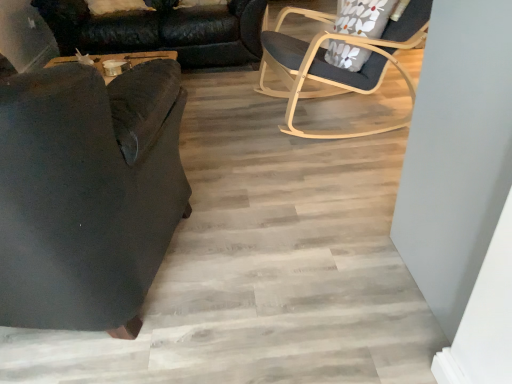
Where is `dark fabric chair at left, positioned as the first chair in left-to-right order`? dark fabric chair at left, positioned as the first chair in left-to-right order is located at coordinates (87, 193).

How different are the orientations of black leather couch at left and light wood/transparentobject at upper right, the second chair viewed from the left, in degrees?

82.6 degrees separate the facing orientations of black leather couch at left and light wood/transparentobject at upper right, the second chair viewed from the left.

Are black leather couch at left and light wood/transparentobject at upper right, the second chair viewed from the left, located far from each other?

black leather couch at left is positioned a significant distance from light wood/transparentobject at upper right, the second chair viewed from the left.

From a real-world perspective, is black leather couch at left positioned under light wood/transparentobject at upper right, arranged as the first chair when viewed from the right, based on gravity?

Yes, from a real-world perspective, black leather couch at left is below light wood/transparentobject at upper right, arranged as the first chair when viewed from the right.

Is black leather couch at left inside the boundaries of light wood/transparentobject at upper right, which is the 2th chair in front-to-back order, or outside?

black leather couch at left is outside light wood/transparentobject at upper right, which is the 2th chair in front-to-back order.

Is dark fabric chair at left, which ranks as the 2th chair in right-to-left order, bigger than floral fabric pillow at upper right?

Yes, dark fabric chair at left, which ranks as the 2th chair in right-to-left order, is bigger than floral fabric pillow at upper right.

From the image's perspective, count 2nd chairs downward from the floral fabric pillow at upper right and point to it. Please provide its 2D coordinates.

[(87, 193)]

Is dark fabric chair at left, which ranks as the 2th chair in right-to-left order, at the left side of floral fabric pillow at upper right?

Correct, you'll find dark fabric chair at left, which ranks as the 2th chair in right-to-left order, to the left of floral fabric pillow at upper right.

Between point (45, 270) and point (366, 29), which one is positioned behind?

Point (366, 29)

From the image's perspective, would you say floral fabric pillow at upper right is positioned over light wood/transparentobject at upper right, arranged as the 1th chair when viewed from the back?

Yes, from the image's perspective, floral fabric pillow at upper right is above light wood/transparentobject at upper right, arranged as the 1th chair when viewed from the back.

Can you confirm if floral fabric pillow at upper right is thinner than light wood/transparentobject at upper right, arranged as the 1th chair when viewed from the back?

Yes.

Does point (334, 62) lie behind point (264, 68)?

No, (334, 62) is in front of (264, 68).

Is floral fabric pillow at upper right next to light wood/transparentobject at upper right, arranged as the 1th chair when viewed from the back, and touching it?

floral fabric pillow at upper right is not next to light wood/transparentobject at upper right, arranged as the 1th chair when viewed from the back, and they're not touching.

Does dark fabric chair at left, positioned as the first chair in left-to-right order, have a lesser height compared to light wood/transparentobject at upper right, which is the 2th chair in front-to-back order?

No.

In terms of width, does dark fabric chair at left, which is counted as the 2th chair, starting from the back, look wider or thinner when compared to light wood/transparentobject at upper right, arranged as the first chair when viewed from the right?

Clearly, dark fabric chair at left, which is counted as the 2th chair, starting from the back, has more width compared to light wood/transparentobject at upper right, arranged as the first chair when viewed from the right.

Is dark fabric chair at left, which is counted as the 2th chair, starting from the back, to the right of light wood/transparentobject at upper right, arranged as the 1th chair when viewed from the back, from the viewer's perspective?

No, dark fabric chair at left, which is counted as the 2th chair, starting from the back, is not to the right of light wood/transparentobject at upper right, arranged as the 1th chair when viewed from the back.

Does point (11, 141) come farther from viewer compared to point (303, 10)?

No, it is not.

Is floral fabric pillow at upper right surrounded by light wood/transparentobject at upper right, the second chair viewed from the left?

Yes, floral fabric pillow at upper right can be found within light wood/transparentobject at upper right, the second chair viewed from the left.

Find the location of `pillow behind the light wood/transparentobject at upper right, which is the 2th chair in front-to-back order`. pillow behind the light wood/transparentobject at upper right, which is the 2th chair in front-to-back order is located at coordinates (362, 17).

Is light wood/transparentobject at upper right, the second chair viewed from the left, next to floral fabric pillow at upper right?

There is a gap between light wood/transparentobject at upper right, the second chair viewed from the left, and floral fabric pillow at upper right.

Does black leather couch at left turn towards dark fabric chair at left, which ranks as the 2th chair in right-to-left order?

Yes, black leather couch at left is aimed at dark fabric chair at left, which ranks as the 2th chair in right-to-left order.

Looking at this image, from a real-world perspective, which object rests below the other?

From a 3D spatial view, black leather couch at left is below.

Would you say black leather couch at left is to the left or to the right of dark fabric chair at left, arranged as the 1th chair when viewed from the front, in the picture?

Clearly, black leather couch at left is on the left of dark fabric chair at left, arranged as the 1th chair when viewed from the front, in the image.

Can you tell me how much black leather couch at left and dark fabric chair at left, which is counted as the 2th chair, starting from the back, differ in facing direction?

167 degrees separate the facing orientations of black leather couch at left and dark fabric chair at left, which is counted as the 2th chair, starting from the back.

In the image, there is a black leather couch at left. What are the coordinates of `pillow below it (from the image's perspective)` in the screenshot? It's located at (362, 17).

Does floral fabric pillow at upper right lie in front of black leather couch at left?

Yes, floral fabric pillow at upper right is in front of black leather couch at left.

What's the angular difference between floral fabric pillow at upper right and black leather couch at left's facing directions?

floral fabric pillow at upper right and black leather couch at left are facing 76.3 degrees away from each other.

Is floral fabric pillow at upper right positioned beyond the bounds of black leather couch at left?

Yes, floral fabric pillow at upper right is located beyond the bounds of black leather couch at left.

I want to click on studio couch on the left of light wood/transparentobject at upper right, arranged as the 1th chair when viewed from the back, so click(x=162, y=31).

Find the location of a particular element. The height and width of the screenshot is (384, 512). pillow below the dark fabric chair at left, arranged as the 1th chair when viewed from the front (from a real-world perspective) is located at coordinates (362, 17).

Looking at the image, which one is located further to light wood/transparentobject at upper right, arranged as the 1th chair when viewed from the back, floral fabric pillow at upper right or dark fabric chair at left, which is counted as the 2th chair, starting from the back?

The object further to light wood/transparentobject at upper right, arranged as the 1th chair when viewed from the back, is dark fabric chair at left, which is counted as the 2th chair, starting from the back.

When comparing their distances from black leather couch at left, does floral fabric pillow at upper right or dark fabric chair at left, positioned as the first chair in left-to-right order, seem closer?

Based on the image, floral fabric pillow at upper right appears to be nearer to black leather couch at left.

When comparing their distances from black leather couch at left, does dark fabric chair at left, arranged as the 1th chair when viewed from the front, or floral fabric pillow at upper right seem closer?

floral fabric pillow at upper right.

Looking at the image, which one is located further to black leather couch at left, light wood/transparentobject at upper right, which is the 2th chair in front-to-back order, or floral fabric pillow at upper right?

Based on the image, floral fabric pillow at upper right appears to be further to black leather couch at left.

Looking at the image, which one is located closer to dark fabric chair at left, arranged as the 1th chair when viewed from the front, light wood/transparentobject at upper right, arranged as the 1th chair when viewed from the back, or floral fabric pillow at upper right?

light wood/transparentobject at upper right, arranged as the 1th chair when viewed from the back.

Based on their spatial positions, is black leather couch at left or dark fabric chair at left, which is counted as the 2th chair, starting from the back, further from light wood/transparentobject at upper right, arranged as the 1th chair when viewed from the back?

dark fabric chair at left, which is counted as the 2th chair, starting from the back, lies further to light wood/transparentobject at upper right, arranged as the 1th chair when viewed from the back, than the other object.

Which object lies nearer to the anchor point light wood/transparentobject at upper right, arranged as the 1th chair when viewed from the back, floral fabric pillow at upper right or black leather couch at left?

floral fabric pillow at upper right lies closer to light wood/transparentobject at upper right, arranged as the 1th chair when viewed from the back, than the other object.

Looking at the image, which one is located further to light wood/transparentobject at upper right, the second chair viewed from the left, dark fabric chair at left, arranged as the 1th chair when viewed from the front, or black leather couch at left?

Among the two, dark fabric chair at left, arranged as the 1th chair when viewed from the front, is located further to light wood/transparentobject at upper right, the second chair viewed from the left.

Where is `chair between dark fabric chair at left, arranged as the 1th chair when viewed from the front, and black leather couch at left, along the z-axis`? This screenshot has height=384, width=512. chair between dark fabric chair at left, arranged as the 1th chair when viewed from the front, and black leather couch at left, along the z-axis is located at coordinates [x=337, y=67].

This screenshot has height=384, width=512. I want to click on pillow positioned between dark fabric chair at left, positioned as the first chair in left-to-right order, and black leather couch at left from near to far, so click(362, 17).

Image resolution: width=512 pixels, height=384 pixels. I want to click on chair between dark fabric chair at left, arranged as the 1th chair when viewed from the front, and floral fabric pillow at upper right in the front-back direction, so click(337, 67).